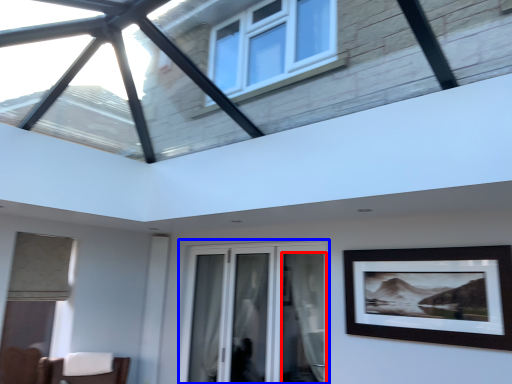
Question: Which object is closer to the camera taking this photo, curtain (highlighted by a red box) or window (highlighted by a blue box)?

Choices:
 (A) curtain
 (B) window

Answer: (A)